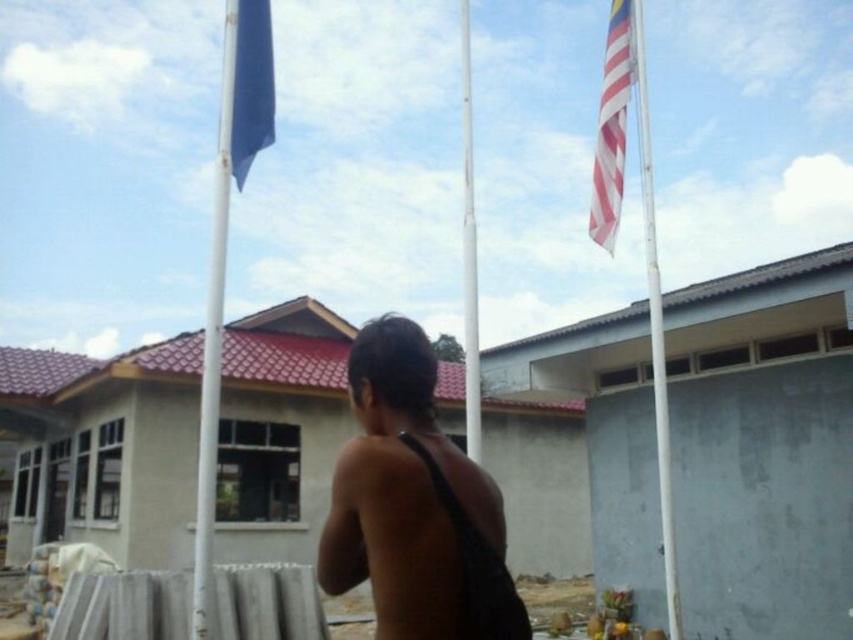
You are a photographer trying to capture a shot of the white glossy flag pole at left and the white metallic flag pole at upper right. Which flag pole should you zoom in on to ensure it appears thicker in the photo?

The white metallic flag pole at upper right is wider than the white glossy flag pole at left, so you should zoom in on the white metallic flag pole at upper right to make it appear thicker in the photo.

You are a drone operator trying to capture a photo of the white glossy flag pole at left from directly above. What coordinates should you aim for to ensure the drone is centered over the flag pole?

The white glossy flag pole at left is located at coordinates point (213, 346), so you should aim the drone to hover at those coordinates to be centered over it.

Looking at this image, you are a photographer trying to capture the white metallic flag pole at upper right in your shot. You want to ensure it is centered in your frame. Given that your camera has a fixed focal length, can you estimate the horizontal and vertical adjustments needed to center the flag pole based on its coordinates?

The white metallic flag pole at upper right is located at coordinates point (654, 330). To center it in your frame, you would need to adjust your camera slightly to the left horizontally and downward vertically to align with these coordinates.